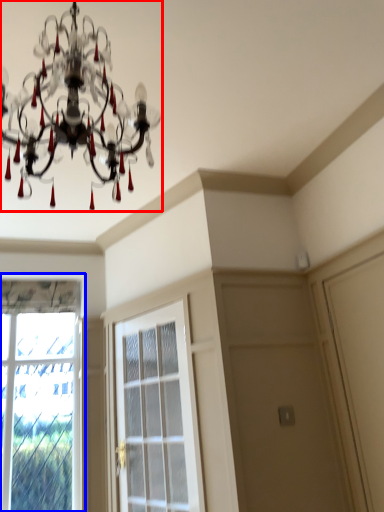
Question: Among these objects, which one is nearest to the camera, lamp (highlighted by a red box) or window (highlighted by a blue box)?

Choices:
 (A) lamp
 (B) window

Answer: (A)